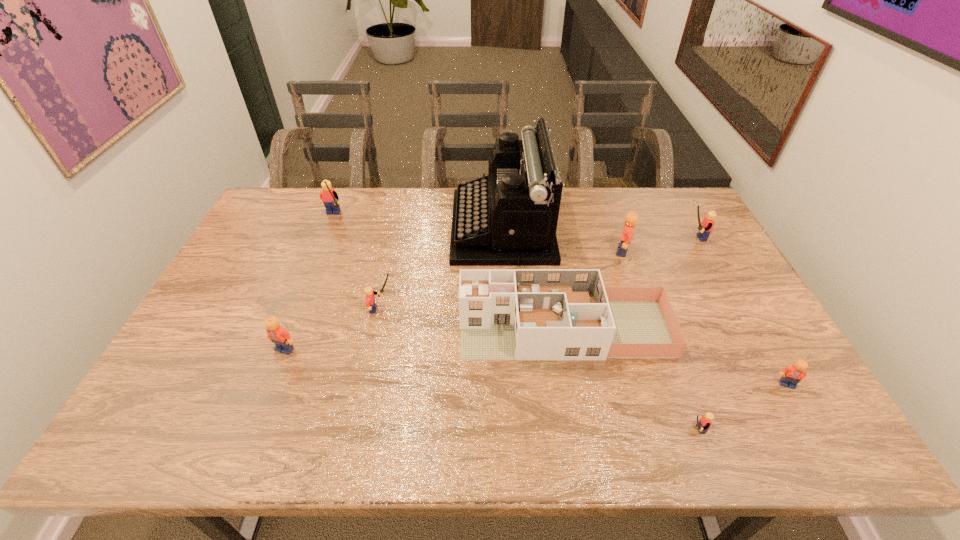
Find the location of a particular element. Image resolution: width=960 pixels, height=540 pixels. blank space located 0.150m on the front-facing side of the fifth farthest Lego is located at coordinates (262, 409).

Locate an element on the screen. free space located on the front-facing side of the third object from left to right is located at coordinates (429, 309).

Image resolution: width=960 pixels, height=540 pixels. I want to click on vacant space located on the front-facing side of the second nearest object, so click(x=815, y=433).

At what (x,y) coordinates should I click in order to perform the action: click on free region located on the front-facing side of the smallest yellow Lego. Please return your answer as a coordinate pair (x, y). This screenshot has width=960, height=540. Looking at the image, I should click on (583, 430).

At what (x,y) coordinates should I click in order to perform the action: click on vacant space located on the front-facing side of the smallest yellow Lego. Please return your answer as a coordinate pair (x, y). The width and height of the screenshot is (960, 540). Looking at the image, I should click on (588, 430).

At what (x,y) coordinates should I click in order to perform the action: click on vacant area situated 0.270m on the front-facing side of the smallest yellow Lego. Please return your answer as a coordinate pair (x, y). The image size is (960, 540). Looking at the image, I should click on (561, 430).

Identify the location of typewriter that is at the far edge. This screenshot has width=960, height=540. (508, 218).

What are the coordinates of `Lego that is at the far edge` in the screenshot? It's located at (328, 196).

Identify the location of object located at the near edge. (704, 423).

Identify the location of free region at the far edge. Image resolution: width=960 pixels, height=540 pixels. (358, 223).